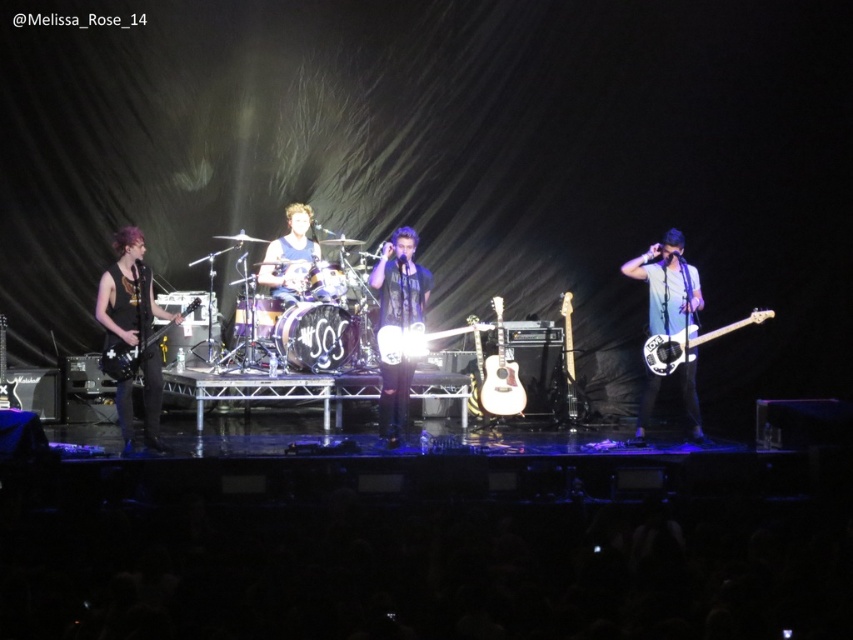
Is blue fabric shirt at center behind shiny silver bass at right?

Yes, blue fabric shirt at center is further from the viewer.

Who is positioned more to the right, blue fabric shirt at center or shiny silver bass at right?

shiny silver bass at right is more to the right.

Who is more distant from viewer, (302,268) or (735,328)?

The point (302,268) is more distant.

Identify the location of blue fabric shirt at center. This screenshot has height=640, width=853. (289, 257).

Can you confirm if shiny silver bass at right is bigger than shiny gold electric guitar at center?

Correct, shiny silver bass at right is larger in size than shiny gold electric guitar at center.

Between shiny silver bass at right and shiny gold electric guitar at center, which one appears on the left side from the viewer's perspective?

shiny gold electric guitar at center

Locate an element on the screen. This screenshot has width=853, height=640. shiny silver bass at right is located at coordinates (688, 342).

Which is below, black matte guitar at left or blue fabric shirt at center?

black matte guitar at left

Is point (170, 316) in front of point (260, 282)?

That is True.

Locate an element on the screen. black matte guitar at left is located at coordinates (126, 294).

The image size is (853, 640). I want to click on black matte guitar at left, so click(126, 294).